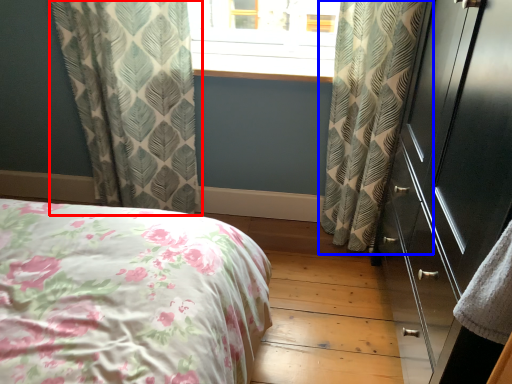
Question: Which object appears farthest to the camera in this image, curtain (highlighted by a red box) or curtain (highlighted by a blue box)?

Choices:
 (A) curtain
 (B) curtain

Answer: (A)